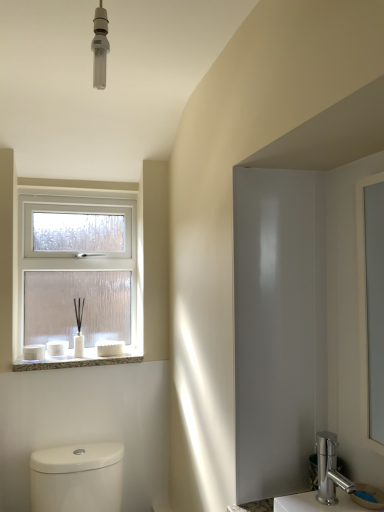
Image resolution: width=384 pixels, height=512 pixels. Find the location of `chrome metallic faucet at lower right`. chrome metallic faucet at lower right is located at coordinates (331, 485).

The height and width of the screenshot is (512, 384). Find the location of `clear glass window at upper left`. clear glass window at upper left is located at coordinates (78, 275).

Where is `white glossy toilet at lower left`? The width and height of the screenshot is (384, 512). white glossy toilet at lower left is located at coordinates (77, 478).

Which is behind, point (81, 487) or point (108, 268)?

Positioned behind is point (108, 268).

Considering the sizes of objects white glossy toilet at lower left and clear glass window at upper left in the image provided, who is smaller, white glossy toilet at lower left or clear glass window at upper left?

clear glass window at upper left is smaller.

Based on the photo, between white glossy toilet at lower left and clear glass window at upper left, which one has more height?

clear glass window at upper left is taller.

Which is more to the right, white glossy toilet at lower left or clear glass window at upper left?

white glossy toilet at lower left is more to the right.

Is chrome metallic faucet at lower right shorter than polished silver faucet at lower right?

No, chrome metallic faucet at lower right is not shorter than polished silver faucet at lower right.

Can you confirm if chrome metallic faucet at lower right is wider than polished silver faucet at lower right?

No, chrome metallic faucet at lower right is not wider than polished silver faucet at lower right.

Is polished silver faucet at lower right at the back of chrome metallic faucet at lower right?

No, polished silver faucet at lower right is not at the back of chrome metallic faucet at lower right.

Is chrome metallic faucet at lower right bigger or smaller than polished silver faucet at lower right?

Clearly, chrome metallic faucet at lower right is larger in size than polished silver faucet at lower right.

From a real-world perspective, between clear glass window at upper left and polished silver faucet at lower right, who is vertically higher?

From a 3D spatial view, clear glass window at upper left is above.

From the image's perspective, is clear glass window at upper left on polished silver faucet at lower right?

Yes.

Can polished silver faucet at lower right be found inside clear glass window at upper left?

No.

Does clear glass window at upper left appear on the right side of polished silver faucet at lower right?

No, clear glass window at upper left is not to the right of polished silver faucet at lower right.

From the image's perspective, is clear glass window at upper left positioned above or below white glossy toilet at lower left?

Clearly, from the image's perspective, clear glass window at upper left is above white glossy toilet at lower left.

Based on their positions, is clear glass window at upper left located to the left or right of white glossy toilet at lower left?

Clearly, clear glass window at upper left is on the left of white glossy toilet at lower left in the image.

Can you confirm if white glossy toilet at lower left is positioned to the right of chrome metallic faucet at lower right?

No, white glossy toilet at lower left is not to the right of chrome metallic faucet at lower right.

From a real-world perspective, is white glossy toilet at lower left positioned over chrome metallic faucet at lower right based on gravity?

No.

Find the location of a particular element. Image resolution: width=384 pixels, height=512 pixels. sink in front of the white glossy toilet at lower left is located at coordinates (331, 485).

From the picture: From a real-world perspective, between white textured stone at lower left and polished silver faucet at lower right, who is vertically higher?

In real-world perspective, white textured stone at lower left is above.

Which of these two, white textured stone at lower left or polished silver faucet at lower right, is thinner?

Thinner between the two is polished silver faucet at lower right.

Measure the distance from white textured stone at lower left to polished silver faucet at lower right.

1.06 meters.

Considering the relative sizes of white textured stone at lower left and polished silver faucet at lower right in the image provided, is white textured stone at lower left shorter than polished silver faucet at lower right?

Yes.

Is clear glass window at upper left completely or partially inside polished silver faucet at lower right?

Definitely not — clear glass window at upper left is not inside polished silver faucet at lower right.

Considering the positions of objects polished silver faucet at lower right and clear glass window at upper left in the image provided, who is more to the right, polished silver faucet at lower right or clear glass window at upper left?

polished silver faucet at lower right.

From the image's perspective, is polished silver faucet at lower right above or below clear glass window at upper left?

polished silver faucet at lower right is situated lower than clear glass window at upper left in the image.

Locate an element on the screen. The width and height of the screenshot is (384, 512). toilet lying on the right of clear glass window at upper left is located at coordinates (77, 478).

This screenshot has height=512, width=384. I want to click on sink that is in front of the polished silver faucet at lower right, so click(331, 485).

From the image, which object appears to be farther from white glossy toilet at lower left, clear glass window at upper left or white textured stone at lower left?

clear glass window at upper left.

From the image, which object appears to be farther from chrome metallic faucet at lower right, clear glass window at upper left or polished silver faucet at lower right?

Based on the image, clear glass window at upper left appears to be further to chrome metallic faucet at lower right.

Looking at the image, which one is located closer to chrome metallic faucet at lower right, clear glass window at upper left or white textured stone at lower left?

white textured stone at lower left.

Considering their positions, is polished silver faucet at lower right positioned closer to white textured stone at lower left than white glossy toilet at lower left?

Based on the image, white glossy toilet at lower left appears to be nearer to white textured stone at lower left.

Based on their spatial positions, is chrome metallic faucet at lower right or white textured stone at lower left further from polished silver faucet at lower right?

white textured stone at lower left is positioned further to the anchor polished silver faucet at lower right.

Considering their positions, is polished silver faucet at lower right positioned closer to clear glass window at upper left than chrome metallic faucet at lower right?

Based on the image, chrome metallic faucet at lower right appears to be nearer to clear glass window at upper left.

From the picture: Estimate the real-world distances between objects in this image. Which object is closer to clear glass window at upper left, polished silver faucet at lower right or white textured stone at lower left?

white textured stone at lower left is closer to clear glass window at upper left.

Based on their spatial positions, is polished silver faucet at lower right or clear glass window at upper left closer to white textured stone at lower left?

clear glass window at upper left.

The height and width of the screenshot is (512, 384). Identify the location of sink between white glossy toilet at lower left and polished silver faucet at lower right from left to right. (331, 485).

Where is `window sill between clear glass window at upper left and white glossy toilet at lower left vertically`? The height and width of the screenshot is (512, 384). window sill between clear glass window at upper left and white glossy toilet at lower left vertically is located at coordinates (78, 360).

Where is `toilet between white textured stone at lower left and chrome metallic faucet at lower right in the horizontal direction`? toilet between white textured stone at lower left and chrome metallic faucet at lower right in the horizontal direction is located at coordinates (77, 478).

Locate an element on the screen. The image size is (384, 512). toilet between clear glass window at upper left and polished silver faucet at lower right is located at coordinates (77, 478).